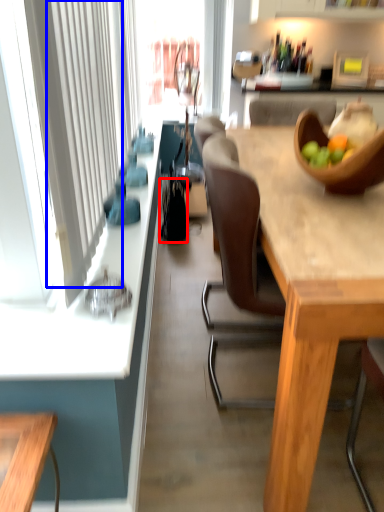
Question: Which point is further to the camera, handbag (highlighted by a red box) or curtain (highlighted by a blue box)?

Choices:
 (A) handbag
 (B) curtain

Answer: (A)